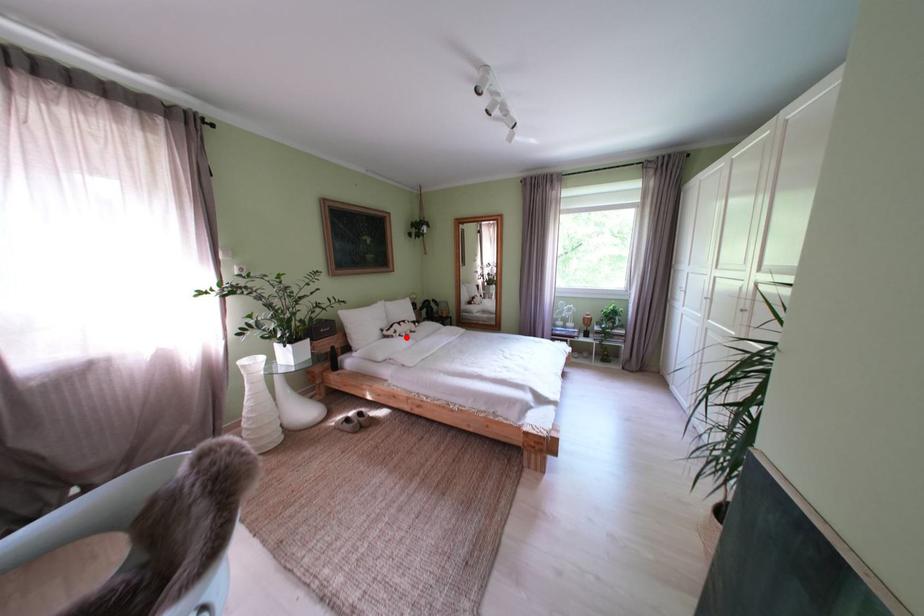
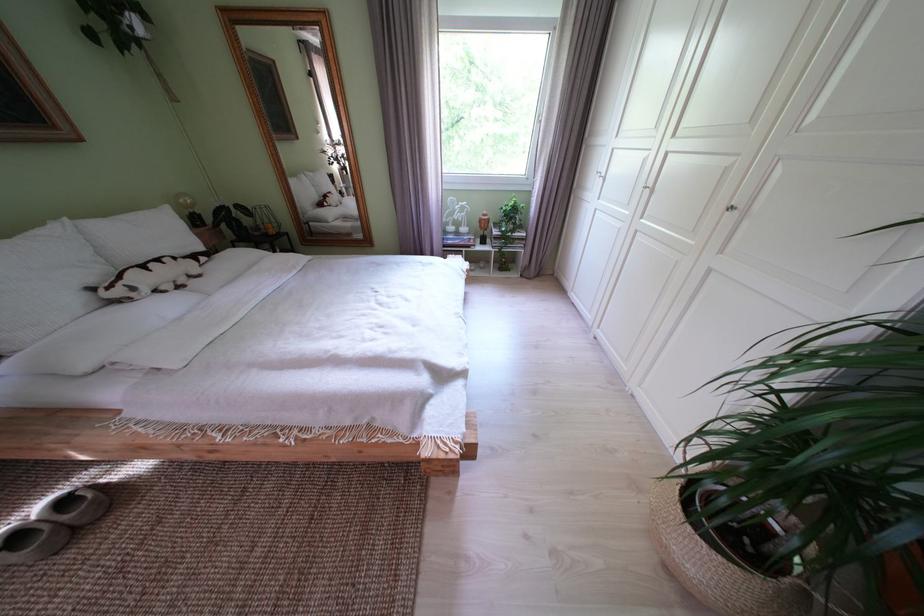
In the second image, find the point that corresponds to the highlighted location in the first image.

(146, 294)